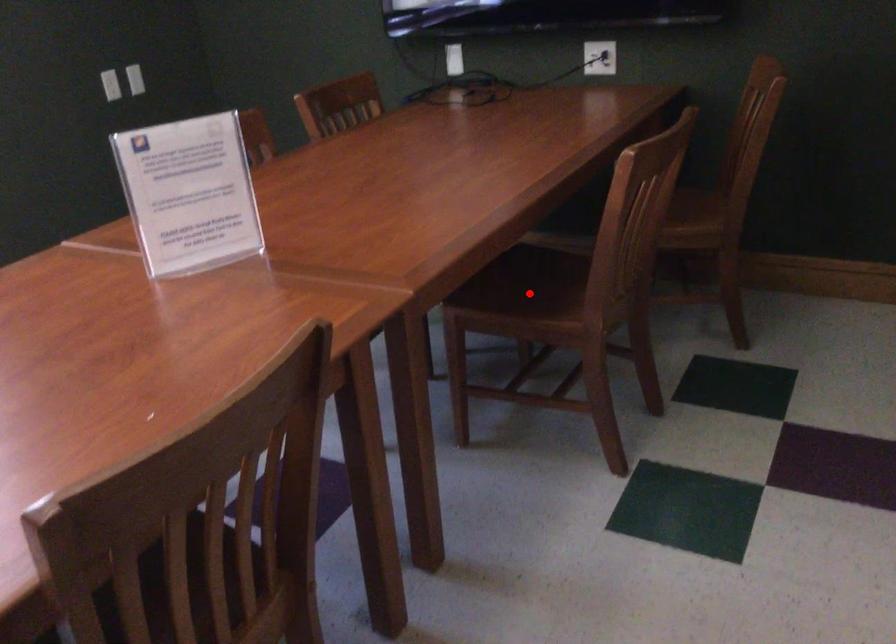
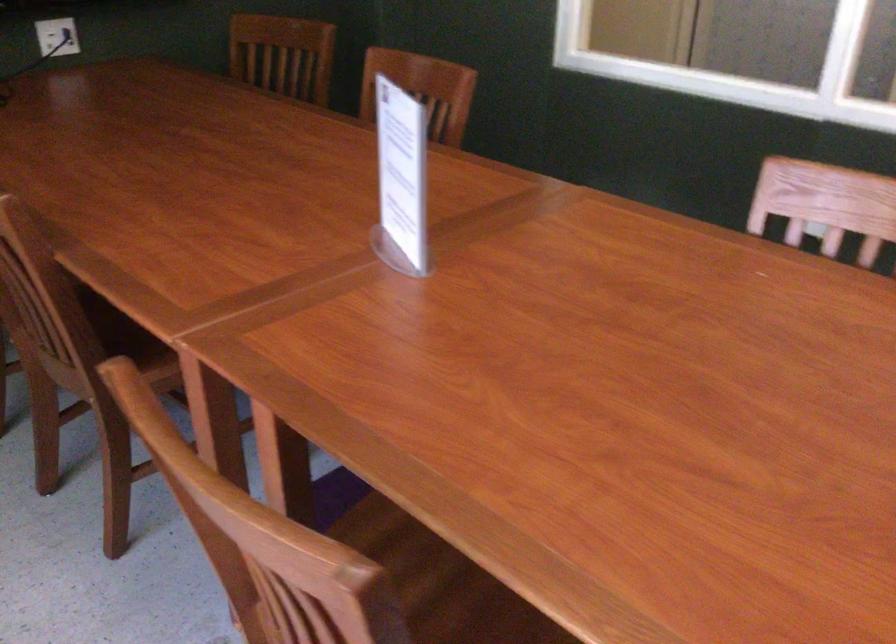
Question: I am providing you with two images of the same scene from different viewpoints. A red point is marked on the first image. At the location where the point appears in image 1, is it still visible in image 2?

Choices:
 (A) Yes
 (B) No

Answer: (B)